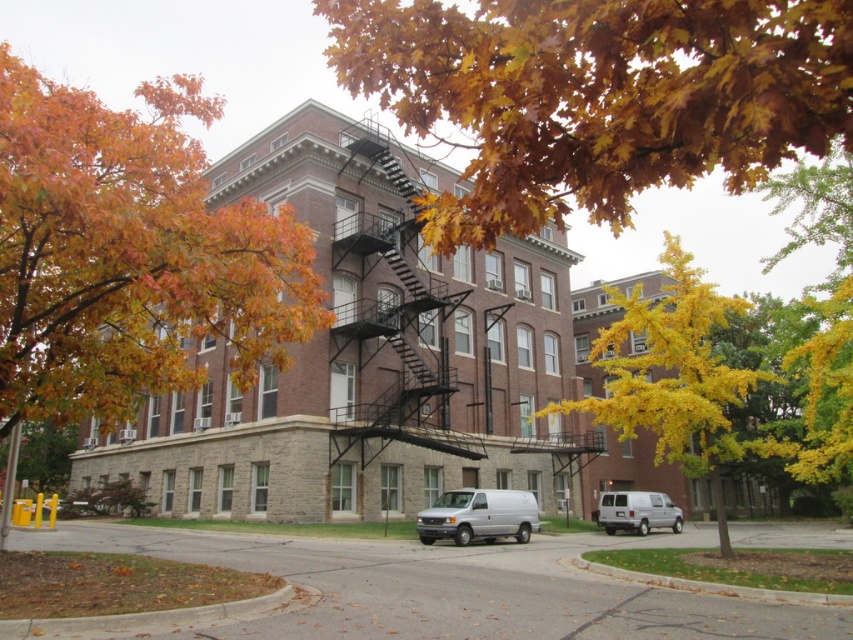
Who is more forward, (415, 285) or (595, 353)?

Point (595, 353)

In order to click on black metal fire escape at center in this screenshot , I will do `click(397, 326)`.

What are the coordinates of `black metal fire escape at center` in the screenshot? It's located at (397, 326).

Is golden leafy branch at upper center wider than black metal fire escape at center?

No.

Does golden leafy branch at upper center have a lesser height compared to black metal fire escape at center?

Incorrect, golden leafy branch at upper center's height does not fall short of black metal fire escape at center's.

Image resolution: width=853 pixels, height=640 pixels. What are the coordinates of `golden leafy branch at upper center` in the screenshot? It's located at (596, 97).

The height and width of the screenshot is (640, 853). Find the location of `golden leafy branch at upper center`. golden leafy branch at upper center is located at coordinates (596, 97).

Does yellow/golden leaves at center appear on the right side of white matte van at lower right?

Indeed, yellow/golden leaves at center is positioned on the right side of white matte van at lower right.

Who is taller, yellow/golden leaves at center or white matte van at lower right?

yellow/golden leaves at center

Which is behind, point (619, 385) or point (631, 513)?

The point (631, 513) is more distant.

Find the location of a particular element. yellow/golden leaves at center is located at coordinates (672, 374).